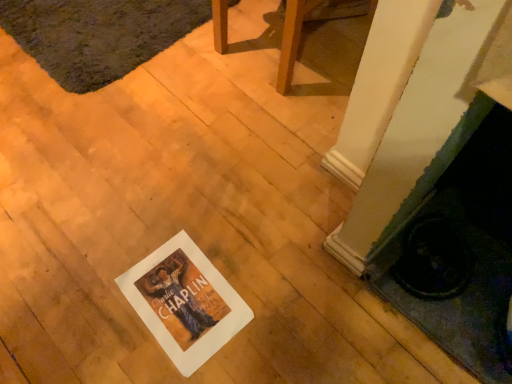
Locate an element on the screen. The height and width of the screenshot is (384, 512). vacant space behind white paper at center is located at coordinates (196, 214).